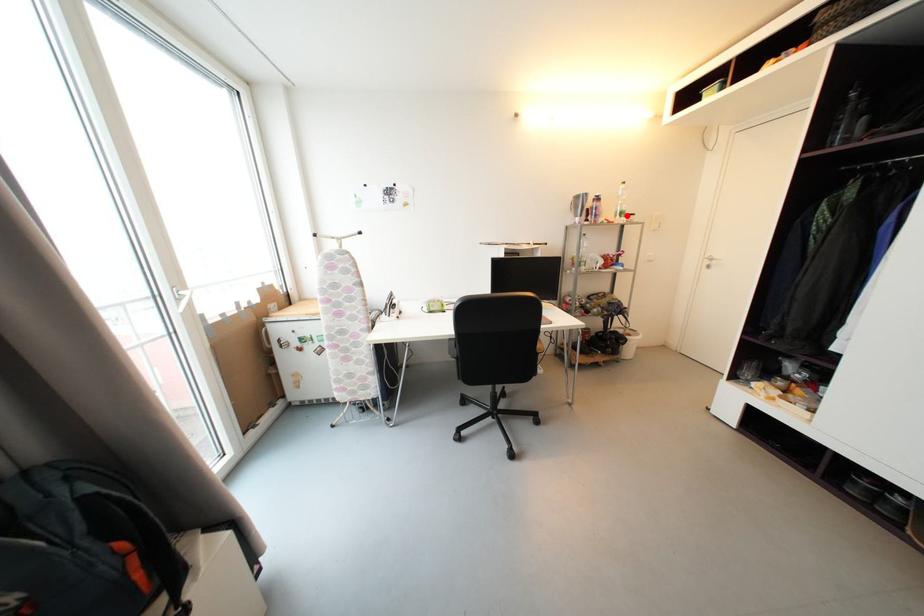
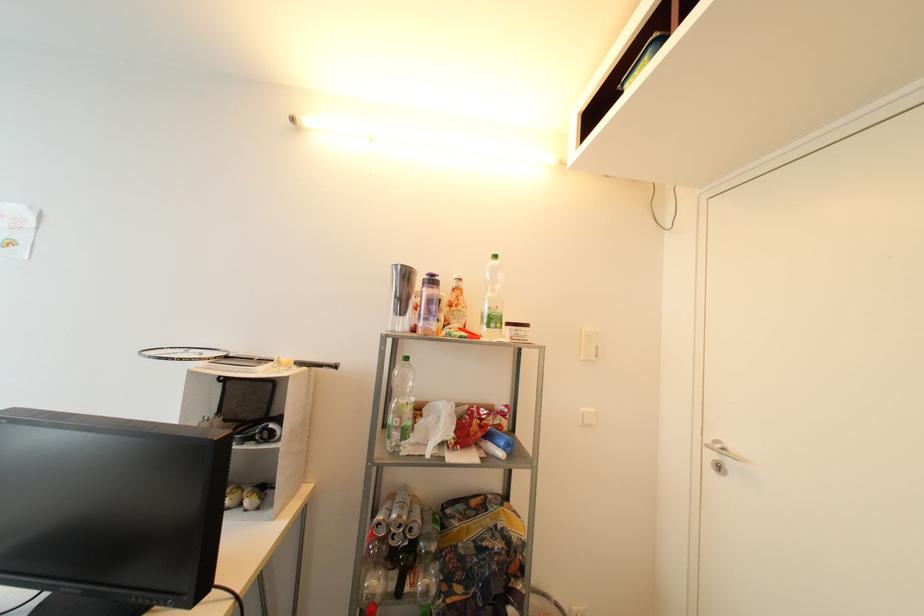
Where in the second image is the point corresponding to the highlighted location from the first image?

(499, 322)